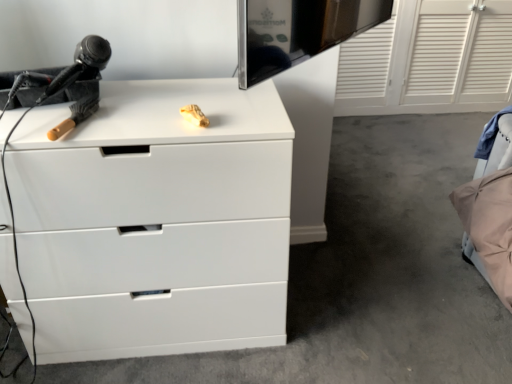
At what (x,y) coordinates should I click in order to perform the action: click on vacant space to the right of white matte chest of drawers at center. Please return your answer as a coordinate pair (x, y). This screenshot has height=384, width=512. Looking at the image, I should click on (346, 297).